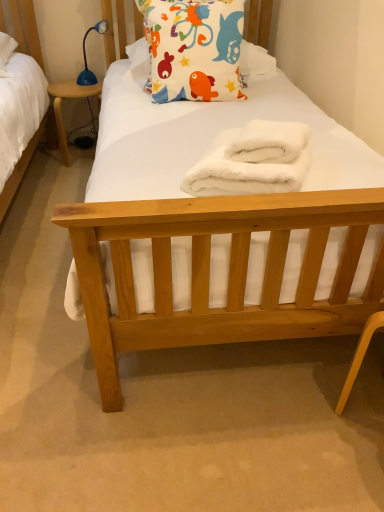
Image resolution: width=384 pixels, height=512 pixels. I want to click on free spot above blue plastic desk at left (from a real-world perspective), so click(x=80, y=86).